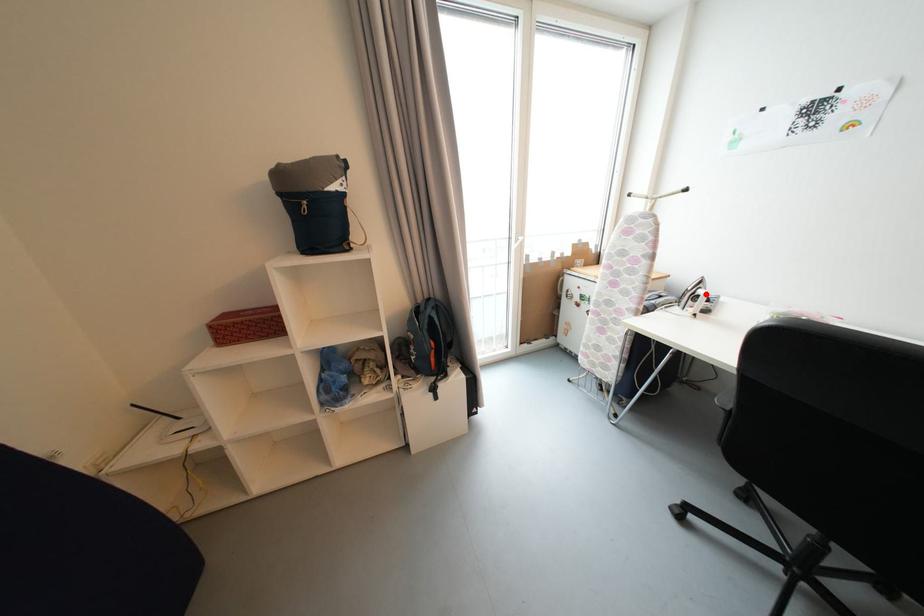
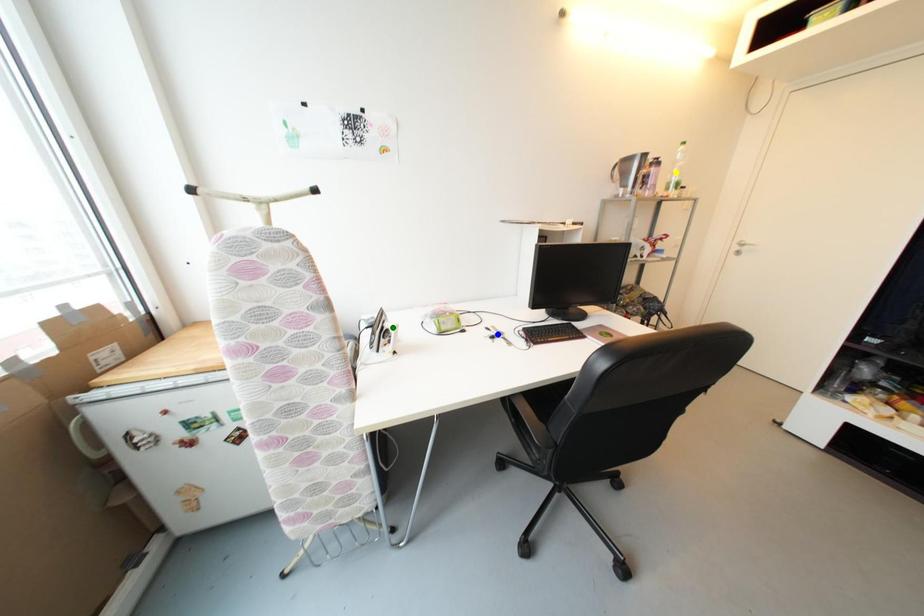
Question: I am providing you with two images of the same scene from different viewpoints. A red point is marked on the first image. You are given multiple points on the second image. Which point in image 2 represents the same 3d spot as the red point in image 1?

Choices:
 (A) blue point
 (B) green point
 (C) yellow point

Answer: (B)